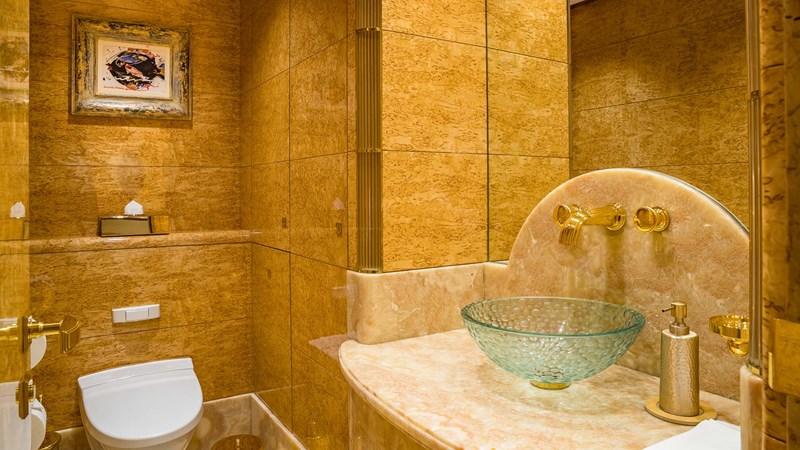
Locate an element on the screen. This screenshot has width=800, height=450. door is located at coordinates (26, 260).